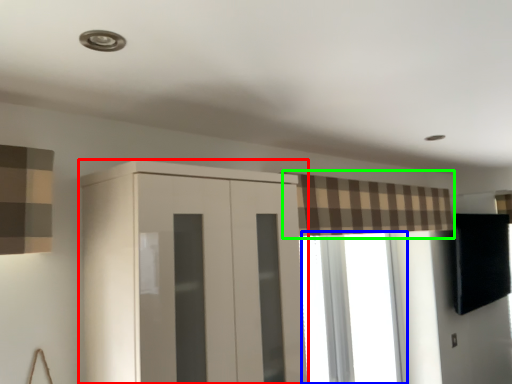
Question: Estimate the real-world distances between objects in this image. Which object is closer to cupboard (highlighted by a red box), window (highlighted by a blue box) or curtain (highlighted by a green box)?

Choices:
 (A) window
 (B) curtain

Answer: (B)